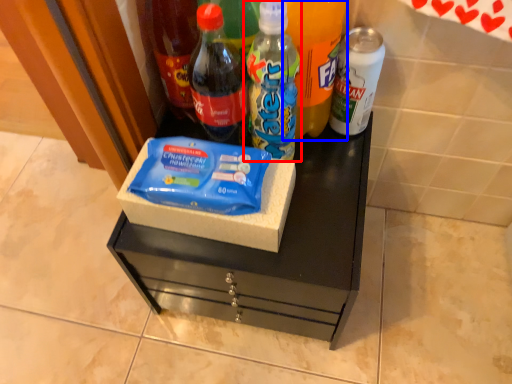
Question: Which object is closer to the camera taking this photo, bottle (highlighted by a red box) or bottle (highlighted by a blue box)?

Choices:
 (A) bottle
 (B) bottle

Answer: (B)